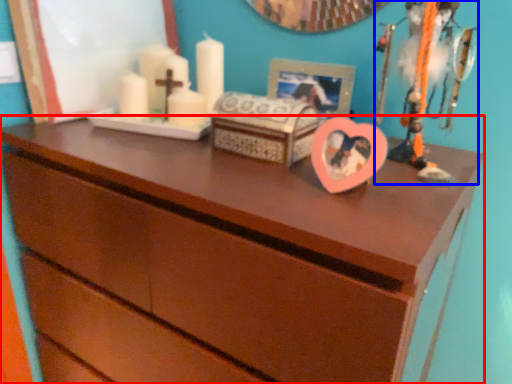
Question: Which object appears farthest to the camera in this image, chest of drawers (highlighted by a red box) or toy (highlighted by a blue box)?

Choices:
 (A) chest of drawers
 (B) toy

Answer: (B)